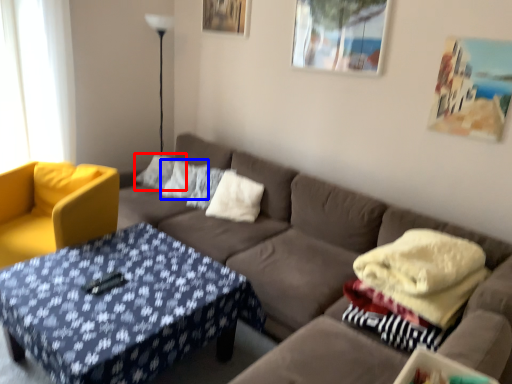
Question: Which point is closer to the camera, pillow (highlighted by a red box) or pillow (highlighted by a blue box)?

Choices:
 (A) pillow
 (B) pillow

Answer: (B)